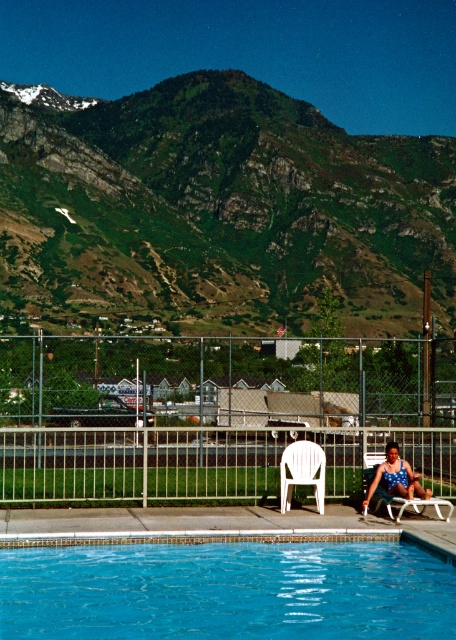
Question: Which object is the farthest from the white plastic fence at center?

Choices:
 (A) white plastic chair at center
 (B) blue dotted swimsuit at lower right

Answer: (B)

Question: Is blue glossy water at center bigger than white plastic chair at center?

Choices:
 (A) yes
 (B) no

Answer: (B)

Question: Does white plastic chair at center appear over blue dotted swimsuit at lower right?

Choices:
 (A) yes
 (B) no

Answer: (A)

Question: Estimate the real-world distances between objects in this image. Which object is closer to the blue glossy water at center?

Choices:
 (A) blue dotted swimsuit at lower right
 (B) white plastic fence at lower center
 (C) white plastic chair at center

Answer: (C)

Question: Which object appears farthest from the camera in this image?

Choices:
 (A) white plastic chair at center
 (B) green rocky mountain at upper center
 (C) white plastic fence at center
 (D) blue glossy water at center

Answer: (B)

Question: Does white plastic fence at center have a greater width compared to white plastic fence at lower center?

Choices:
 (A) yes
 (B) no

Answer: (A)